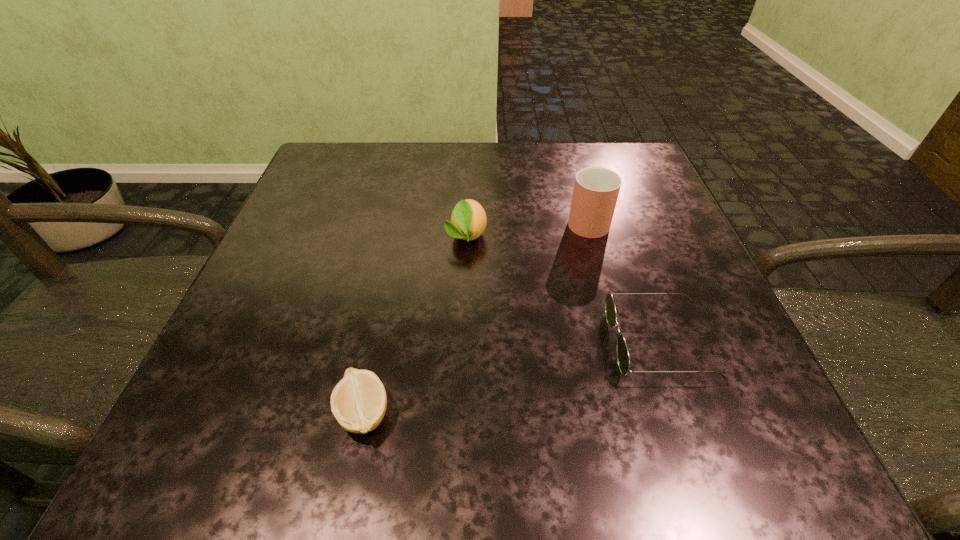
What are the coordinates of `vacant area located 0.070m on the front-facing side of the sunglasses` in the screenshot? It's located at (565, 342).

Identify the location of vacant region located 0.050m on the front-facing side of the sunglasses. (579, 342).

The image size is (960, 540). I want to click on free location located on the front-facing side of the sunglasses, so click(x=432, y=342).

Find the location of a particular element. This screenshot has width=960, height=540. blank area located 0.190m on the right of the shortest object is located at coordinates (535, 414).

Locate an element on the screen. The height and width of the screenshot is (540, 960). object at the near edge is located at coordinates (358, 402).

Locate an element on the screen. Image resolution: width=960 pixels, height=540 pixels. cup located at the right edge is located at coordinates (596, 189).

The width and height of the screenshot is (960, 540). Find the location of `sunglasses positioned at the right edge`. sunglasses positioned at the right edge is located at coordinates (623, 358).

This screenshot has width=960, height=540. I want to click on vacant space at the far edge of the desktop, so click(392, 152).

What are the coordinates of `free region at the near edge of the desktop` in the screenshot? It's located at (517, 419).

The image size is (960, 540). I want to click on vacant space at the left edge of the desktop, so click(276, 379).